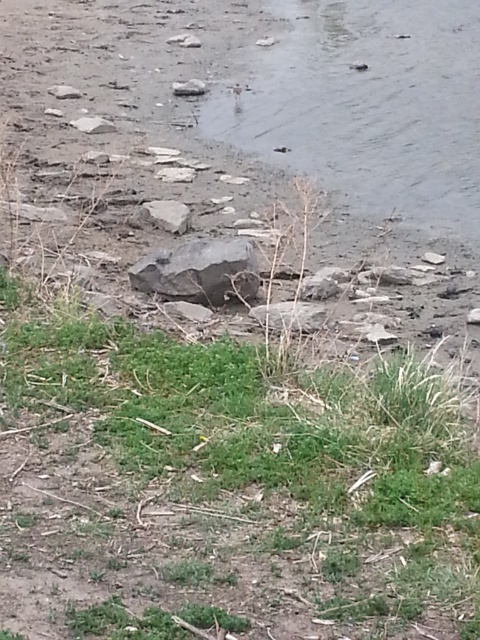
Does gray rough stone at center lie behind white smooth rock at upper left?

No, gray rough stone at center is in front of white smooth rock at upper left.

Can you confirm if gray rough stone at center is smaller than white smooth rock at upper left?

Indeed, gray rough stone at center has a smaller size compared to white smooth rock at upper left.

What do you see at coordinates (166, 216) in the screenshot?
I see `gray rough stone at center` at bounding box center [166, 216].

At what (x,y) coordinates should I click in order to perform the action: click on gray rough stone at center. Please return your answer as a coordinate pair (x, y). The height and width of the screenshot is (640, 480). Looking at the image, I should click on (166, 216).

Where is `gray rough rock at center`? Image resolution: width=480 pixels, height=640 pixels. gray rough rock at center is located at coordinates (200, 272).

Does point (213, 253) come closer to viewer compared to point (172, 218)?

Yes, point (213, 253) is in front of point (172, 218).

The image size is (480, 640). Find the location of `gray rough rock at center`. gray rough rock at center is located at coordinates (200, 272).

Is point (137, 515) farther from camera compared to point (203, 276)?

That is False.

Between green grass at lower center and gray rough rock at center, which one appears on the left side from the viewer's perspective?

gray rough rock at center

I want to click on green grass at lower center, so click(x=228, y=484).